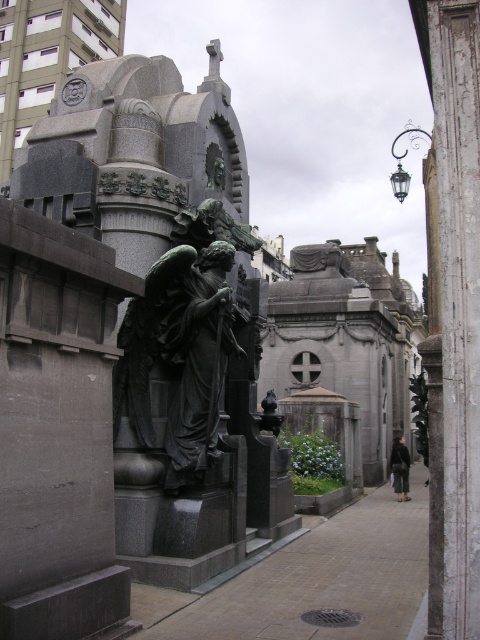
Which is behind, point (179, 614) or point (144, 406)?

The point (144, 406) is behind.

Does smooth concrete pavement at center appear over bronze statue at center?

Actually, smooth concrete pavement at center is below bronze statue at center.

Is point (360, 500) closer to viewer compared to point (144, 307)?

No.

Where is `smooth concrete pavement at center`? Image resolution: width=480 pixels, height=640 pixels. smooth concrete pavement at center is located at coordinates 312,580.